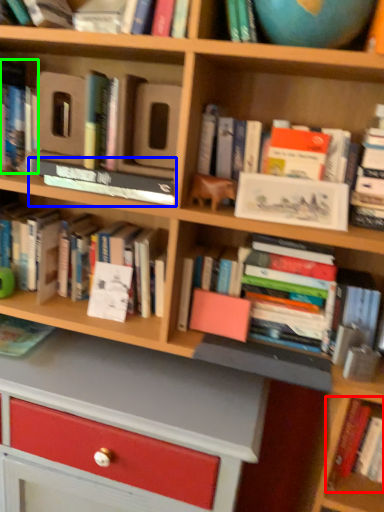
Question: Which object is the farthest from book (highlighted by a red box)? Choose among these: book (highlighted by a blue box) or book (highlighted by a green box).

Choices:
 (A) book
 (B) book

Answer: (B)